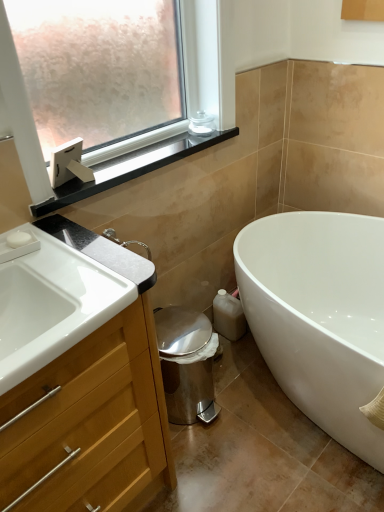
Where is `vacant area that is situated to the right of white matte soap at upper left`? Image resolution: width=384 pixels, height=512 pixels. vacant area that is situated to the right of white matte soap at upper left is located at coordinates (61, 259).